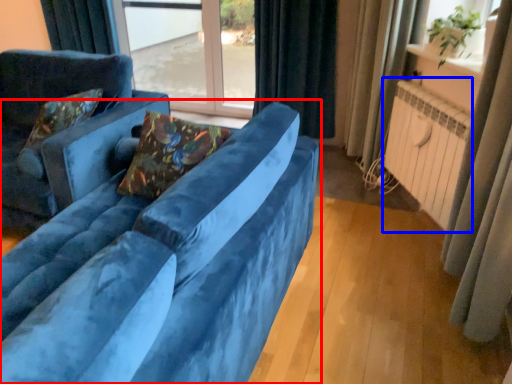
Question: Which of the following is the closest to the observer, studio couch (highlighted by a red box) or radiator (highlighted by a blue box)?

Choices:
 (A) studio couch
 (B) radiator

Answer: (A)